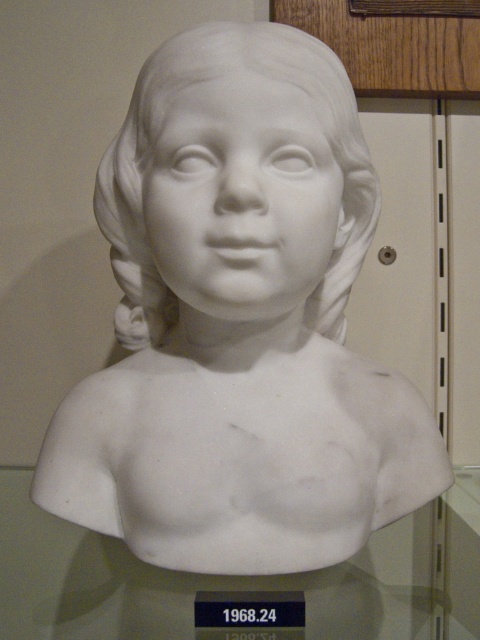
Question: Can you confirm if transparent glass bust at center is wider than white marble bust at center?

Choices:
 (A) no
 (B) yes

Answer: (B)

Question: Which point appears closest to the camera in this image?

Choices:
 (A) (357, 593)
 (B) (264, 49)

Answer: (B)

Question: Which point is farther to the camera?

Choices:
 (A) (164, 54)
 (B) (463, 561)

Answer: (B)

Question: Which point is farther to the camera?

Choices:
 (A) white marble bust at center
 (B) transparent glass bust at center

Answer: (B)

Question: Can you confirm if transparent glass bust at center is bigger than white marble bust at center?

Choices:
 (A) no
 (B) yes

Answer: (B)

Question: Where is transparent glass bust at center located in relation to white marble bust at center in the image?

Choices:
 (A) below
 (B) above

Answer: (A)